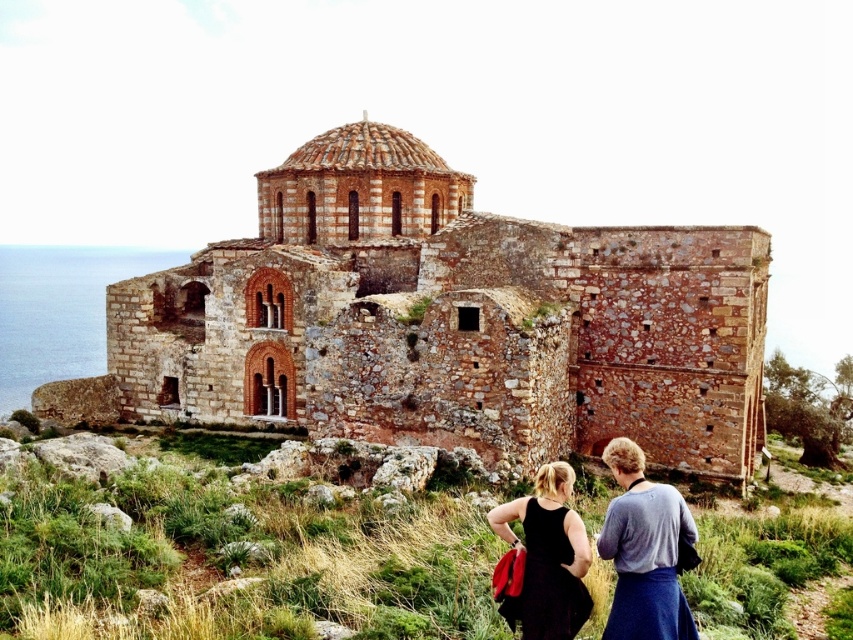
Question: Is black fabric dress at lower center bigger than black fabric dress at lower right?

Choices:
 (A) no
 (B) yes

Answer: (B)

Question: In this image, where is rustic stone church at center located relative to black fabric dress at lower right?

Choices:
 (A) above
 (B) below

Answer: (A)

Question: Which object appears farthest from the camera in this image?

Choices:
 (A) black fabric dress at lower center
 (B) black fabric dress at lower right
 (C) rustic stone church at center

Answer: (C)

Question: Which of the following is the farthest from the observer?

Choices:
 (A) (320, 392)
 (B) (543, 465)

Answer: (A)

Question: Is rustic stone church at center wider than black fabric dress at lower center?

Choices:
 (A) no
 (B) yes

Answer: (B)

Question: Which of the following is the farthest from the observer?

Choices:
 (A) (688, 522)
 (B) (281, 324)

Answer: (B)